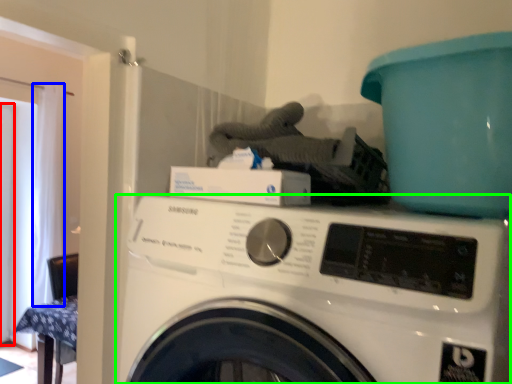
Question: Which is farther away from screen door (highlighted by a red box)? curtain (highlighted by a blue box) or washing machine (highlighted by a green box)?

Choices:
 (A) curtain
 (B) washing machine

Answer: (B)